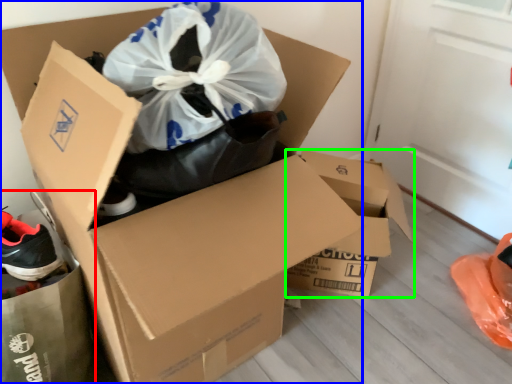
Question: Which object is positioned closest to garbage (highlighted by a red box)? Select from box (highlighted by a blue box) and box (highlighted by a green box).

Choices:
 (A) box
 (B) box

Answer: (A)